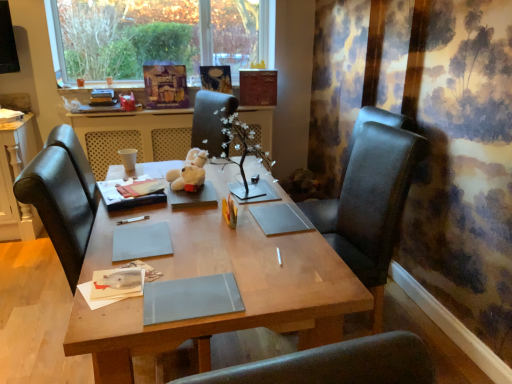
I want to click on free space that is in between gray matte notebook at center, which is the 2th notebook from right to left, and matte gray notebook at center, placed as the first notebook when sorted from front to back, so click(188, 256).